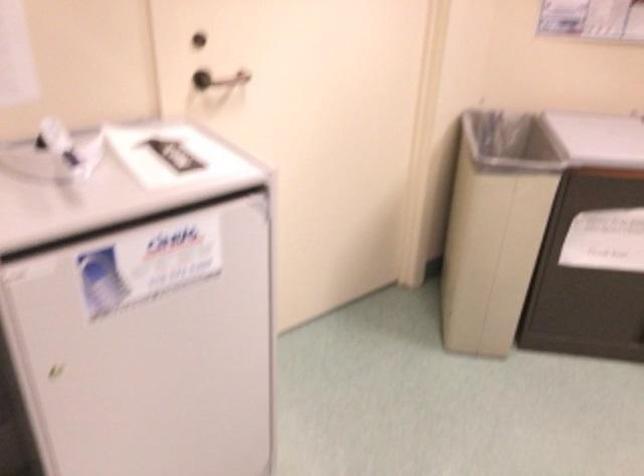
Describe the element at coordinates (146, 343) in the screenshot. I see `a refrigerator door` at that location.